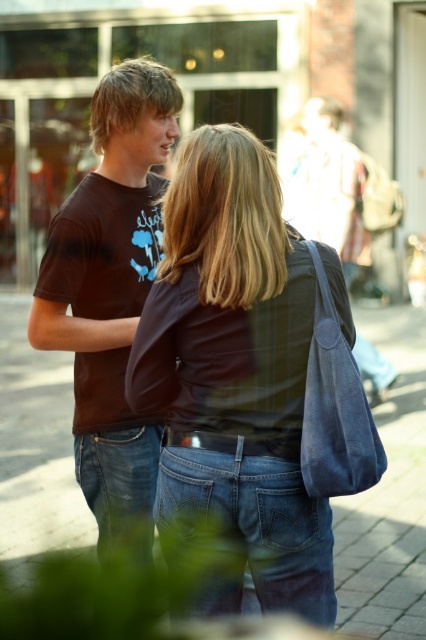
Between dark brown leather jacket at center and brown cotton t-shirt at left, which one has less height?

dark brown leather jacket at center

At what (x,y) coordinates should I click in order to perform the action: click on dark brown leather jacket at center. Please return your answer as a coordinate pair (x, y). Looking at the image, I should click on (235, 365).

Is dark brown leather jacket at center bigger than blue denim jeans at lower center?

Incorrect, dark brown leather jacket at center is not larger than blue denim jeans at lower center.

Does dark brown leather jacket at center have a lesser height compared to blue denim jeans at lower center?

Correct, dark brown leather jacket at center is not as tall as blue denim jeans at lower center.

Is point (241, 317) positioned behind point (23, 556)?

No.

In order to click on dark brown leather jacket at center in this screenshot , I will do `click(235, 365)`.

Image resolution: width=426 pixels, height=640 pixels. What do you see at coordinates (111, 292) in the screenshot?
I see `brown cotton t-shirt at left` at bounding box center [111, 292].

Does brown cotton t-shirt at left appear on the right side of blue denim jeans at lower center?

Incorrect, brown cotton t-shirt at left is not on the right side of blue denim jeans at lower center.

I want to click on brown cotton t-shirt at left, so click(111, 292).

The image size is (426, 640). In order to click on brown cotton t-shirt at left in this screenshot , I will do `click(111, 292)`.